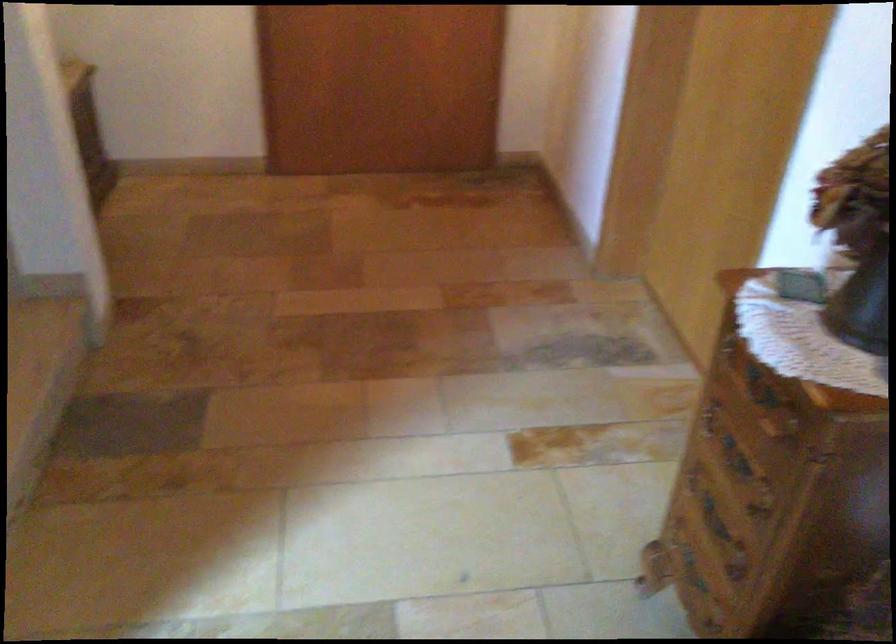
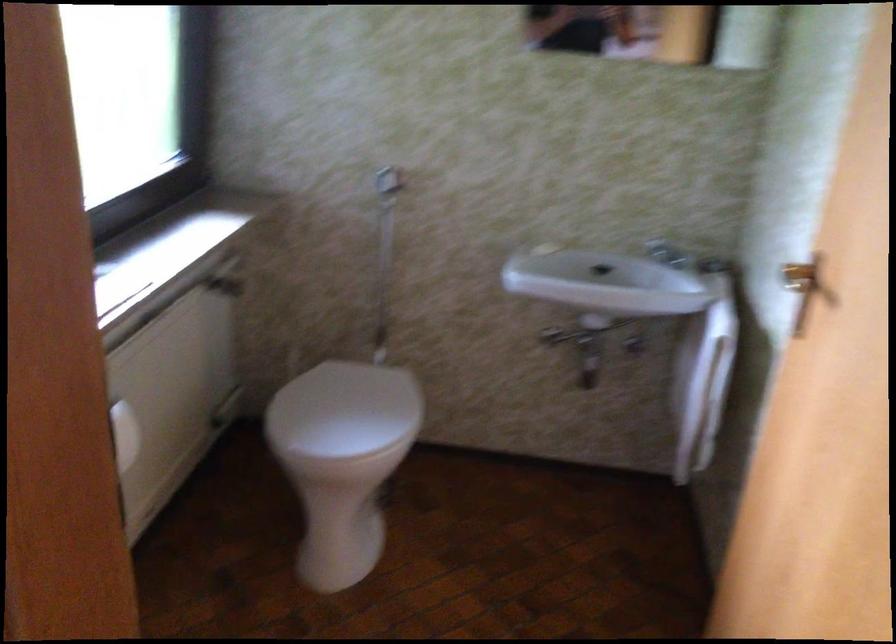
Based on the continuous images, in which direction is the camera rotating?

The camera rotated toward left-down.